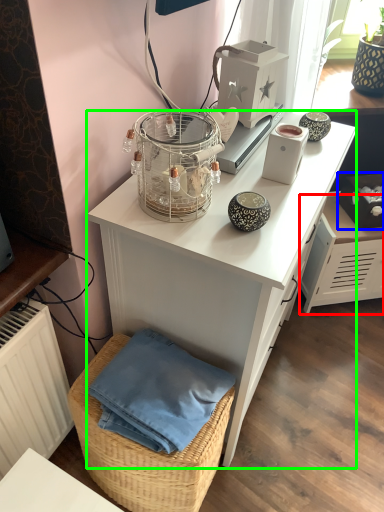
Question: Which object is the farthest from file cabinet (highlighted by a red box)? Choose among these: box (highlighted by a blue box) or desk (highlighted by a green box).

Choices:
 (A) box
 (B) desk

Answer: (B)